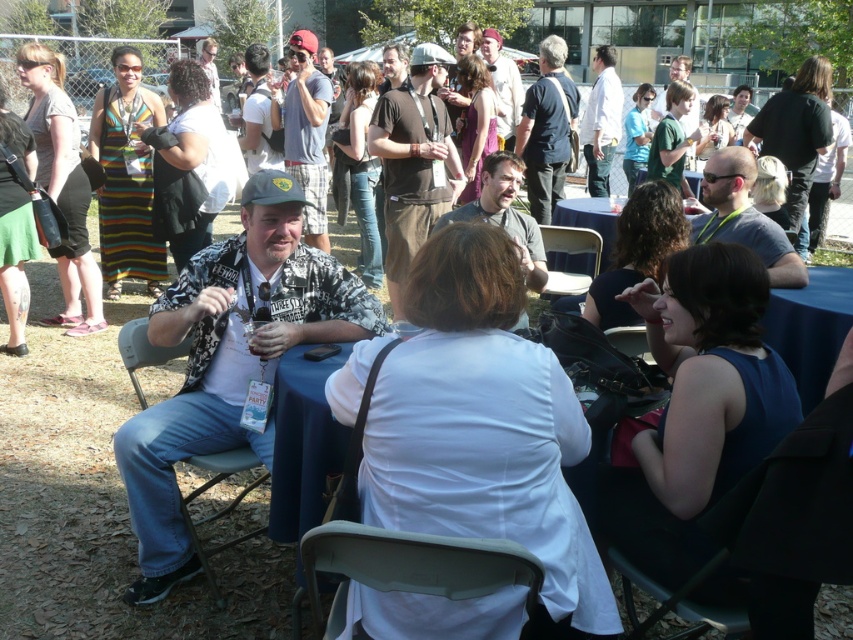
Consider the image. You are planning to sit on the metallic silver chair at center, but there is a light brown leather jacket at upper center nearby. Based on their widths, will the jacket block your access to the chair?

The light brown leather jacket at upper center might be wider than metallic silver chair at center, so there is a possibility that the jacket could block access to the chair depending on its exact placement.

You are a guest at this outdoor event and want to reach the metallic silver chair at center to sit down. You are currently standing 1.5 meters away from the matte brown shirt at center. Can you walk directly to the chair without moving around any obstacles?

The metallic silver chair at center is 1.93 meters away from the matte brown shirt at center. Since you are only 1.5 meters away from the matte brown shirt at center, you are closer to the chair than the distance between them, so you can walk directly to the metallic silver chair at center without needing to move around obstacles.

You are planning to place a rectangular box that is 2 meters wide on the blue fabric table at lower right and the denim shorts at center. Which surface can accommodate the box based on their widths?

The denim shorts at center has a greater width than the blue fabric table at lower right. Since the box is 2 meters wide, the denim shorts at center is the only surface that can accommodate the box if its width is at least 2 meters. However, without knowing the exact width of the denim shorts at center, we cannot confirm for certain. The blue fabric table at lower right cannot accommodate the box as it is narrower than the denim shorts at center, but the exact width is unknown.